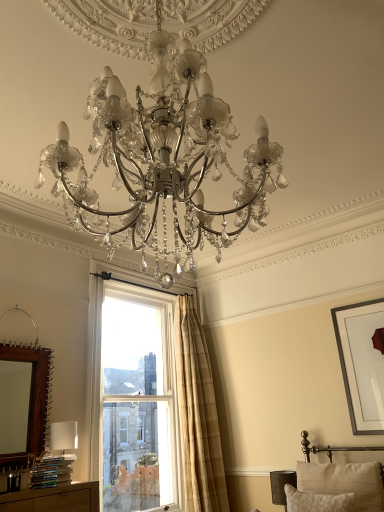
Question: Is dark gray fabric lampshade at lower right bigger or smaller than beige textured pillow at lower right, the second pillow when ordered from front to back?

Choices:
 (A) big
 (B) small

Answer: (B)

Question: Considering their positions, is dark gray fabric lampshade at lower right located in front of or behind beige textured pillow at lower right, which ranks as the 1th pillow in back-to-front order?

Choices:
 (A) behind
 (B) front

Answer: (A)

Question: Considering the real-world distances, which object is farthest from the matte black picture frame at upper right?

Choices:
 (A) brown wooden mirror at left
 (B) beige textured pillow at lower right, positioned as the second pillow in back-to-front order
 (C) beige textured pillow at lower right, the second pillow when ordered from front to back
 (D) matte silver chandelier at center
 (E) dark gray fabric lampshade at lower right

Answer: (D)

Question: Estimate the real-world distances between objects in this image. Which object is closer to the beige textured pillow at lower right, the second pillow when ordered from front to back?

Choices:
 (A) beige plaid curtain at upper right
 (B) beige textured pillow at lower right, positioned as the second pillow in back-to-front order
 (C) clear glass window at center
 (D) matte black picture frame at upper right
 (E) matte silver chandelier at center

Answer: (B)